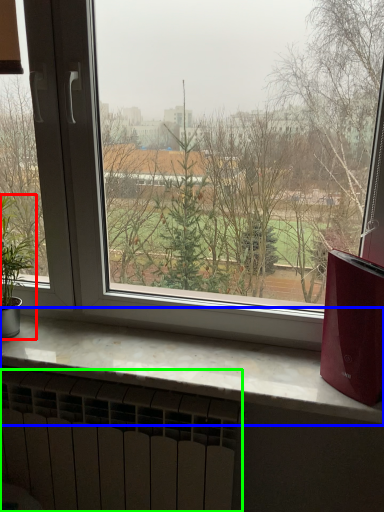
Question: Considering the real-world distances, which object is closest to houseplant (highlighted by a red box)? window sill (highlighted by a blue box) or radiator (highlighted by a green box).

Choices:
 (A) window sill
 (B) radiator

Answer: (A)